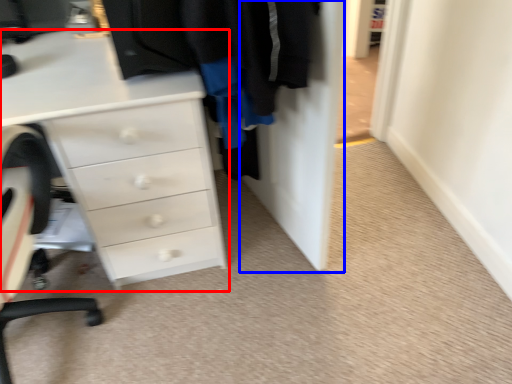
Question: Which object is further to the camera taking this photo, chest of drawers (highlighted by a red box) or door (highlighted by a blue box)?

Choices:
 (A) chest of drawers
 (B) door

Answer: (A)